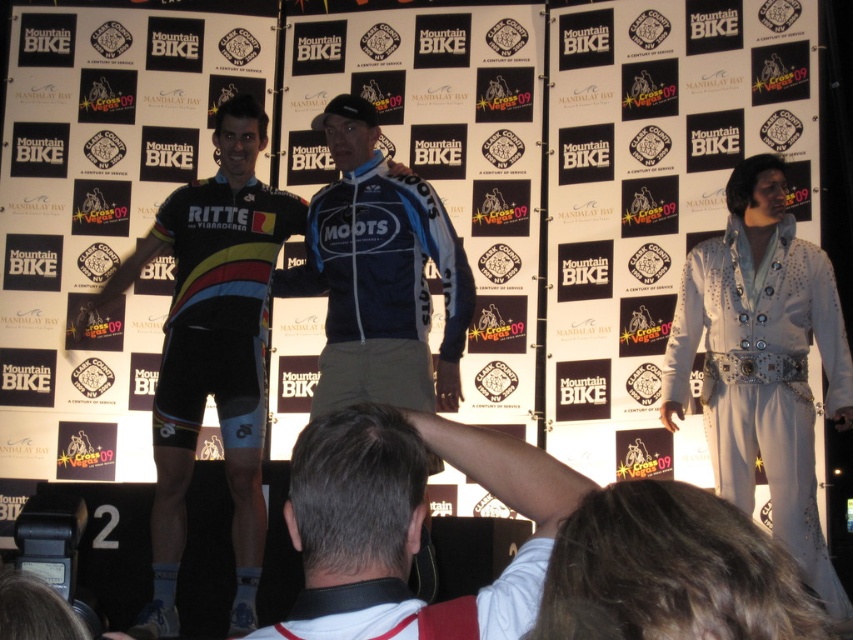
Question: Can you confirm if white satin suit at right is bigger than white cotton shirt at center?

Choices:
 (A) no
 (B) yes

Answer: (B)

Question: Which point is farther to the camera?

Choices:
 (A) white satin suit at right
 (B) white cotton shirt at center

Answer: (A)

Question: Which object appears farthest from the camera in this image?

Choices:
 (A) white satin suit at right
 (B) white cotton shirt at center

Answer: (A)

Question: Can you confirm if white satin suit at right is positioned below white cotton shirt at center?

Choices:
 (A) no
 (B) yes

Answer: (A)

Question: Among these points, which one is farthest from the camera?

Choices:
 (A) (808, 424)
 (B) (303, 484)

Answer: (A)

Question: Can you confirm if white satin suit at right is positioned below white cotton shirt at center?

Choices:
 (A) yes
 (B) no

Answer: (B)